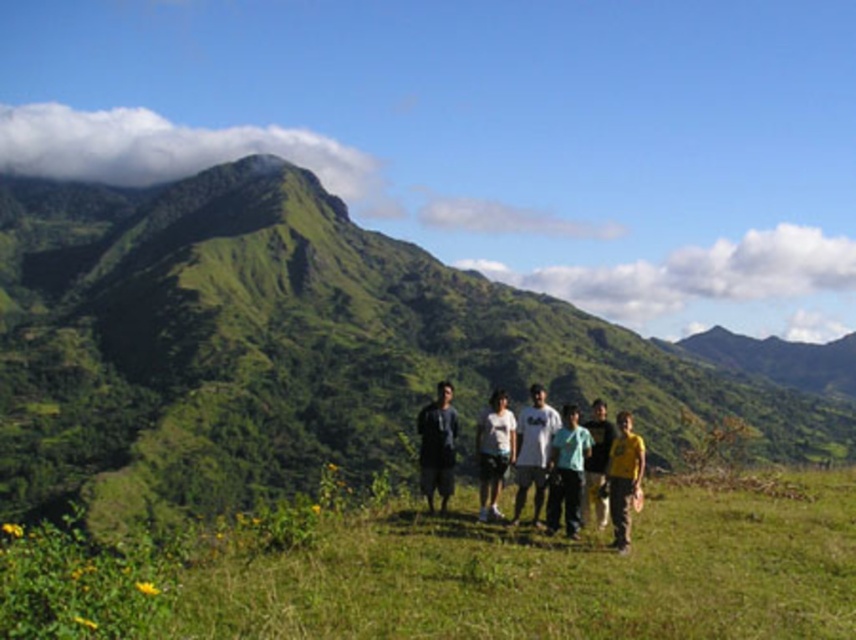
Can you confirm if light blue t-shirt at center is positioned to the left of white matte shirt at center?

No, light blue t-shirt at center is not to the left of white matte shirt at center.

Is point (559, 428) farther from camera compared to point (492, 412)?

That is False.

I want to click on light blue t-shirt at center, so click(565, 470).

Who is shorter, light blue shirt at center or white matte shirt at center?

A: light blue shirt at center

Does light blue shirt at center appear under white matte shirt at center?

No.

Locate an element on the screen. The height and width of the screenshot is (640, 856). light blue shirt at center is located at coordinates (566, 472).

Is green grassy field at center bigger than yellow cotton shirt at center?

Yes.

Is point (610, 602) positioned before point (593, 419)?

Yes.

Identify the location of green grassy field at center. Image resolution: width=856 pixels, height=640 pixels. (553, 573).